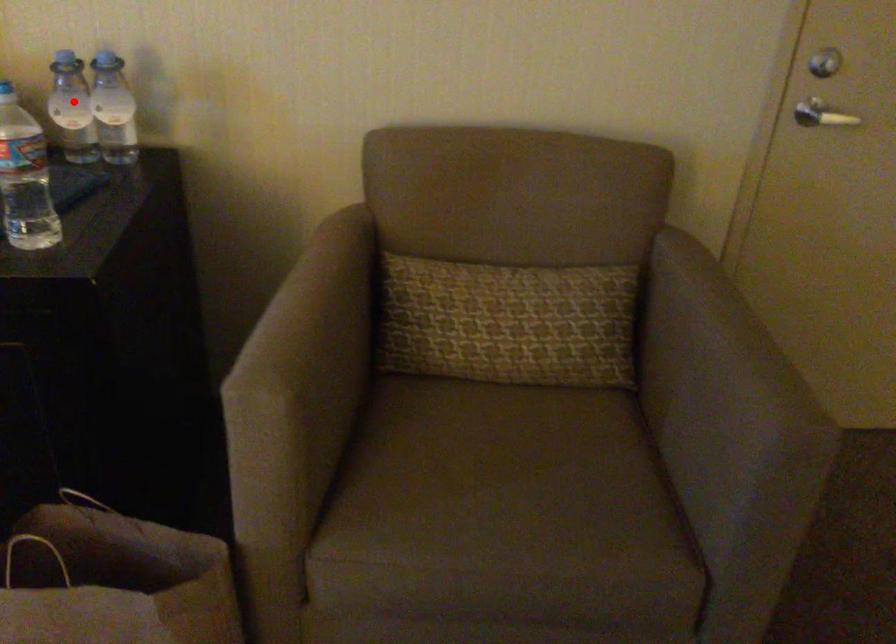
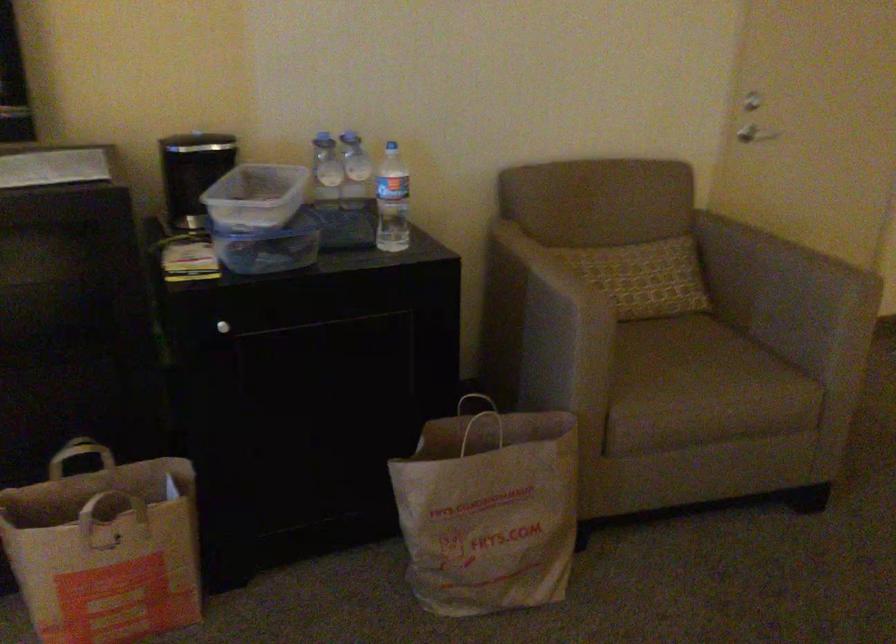
Where in the second image is the point corresponding to the highlighted location from the first image?

(325, 169)